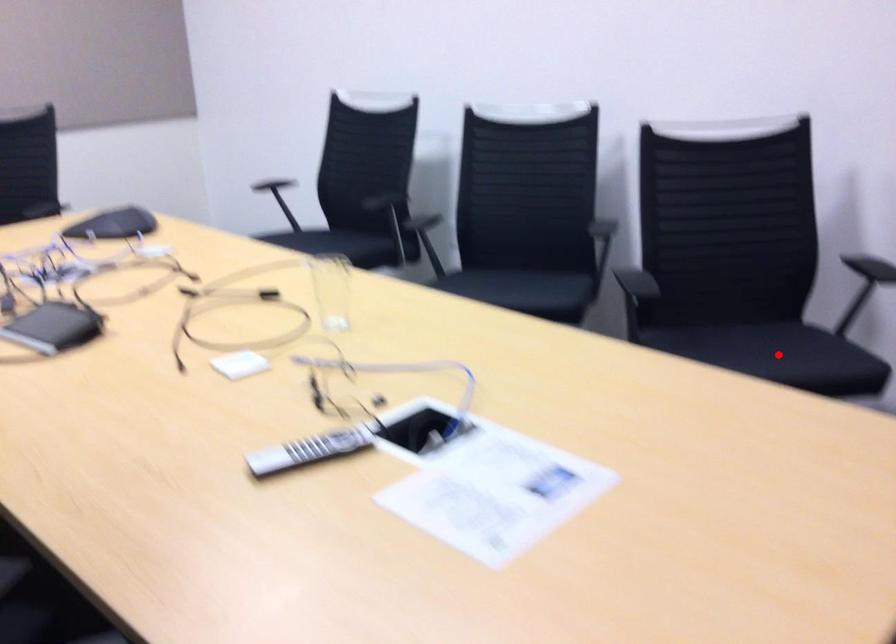
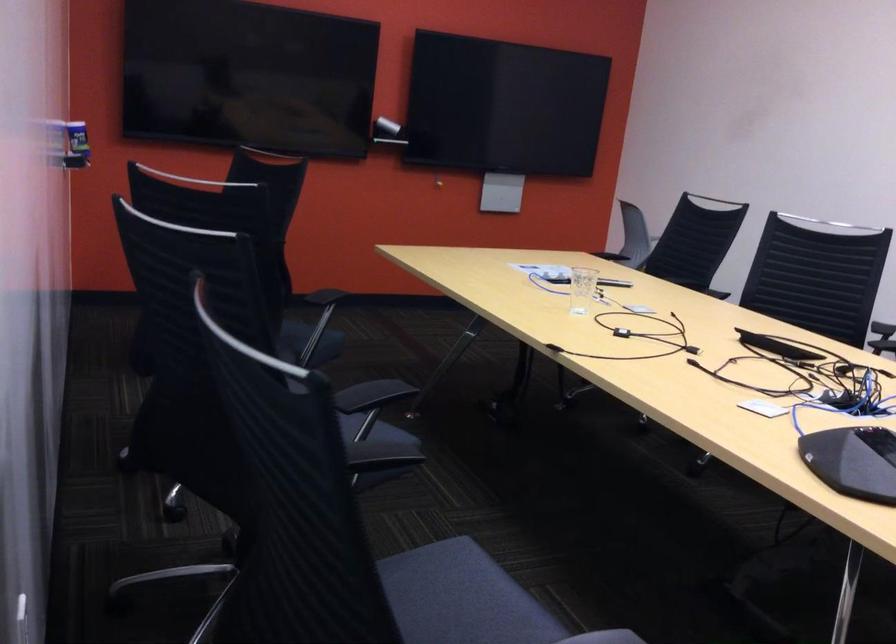
Question: I am providing you with two images of the same scene from different viewpoints. A red point is marked on the first image. Is the red point's position out of view in image 2?

Choices:
 (A) Yes
 (B) No

Answer: (A)